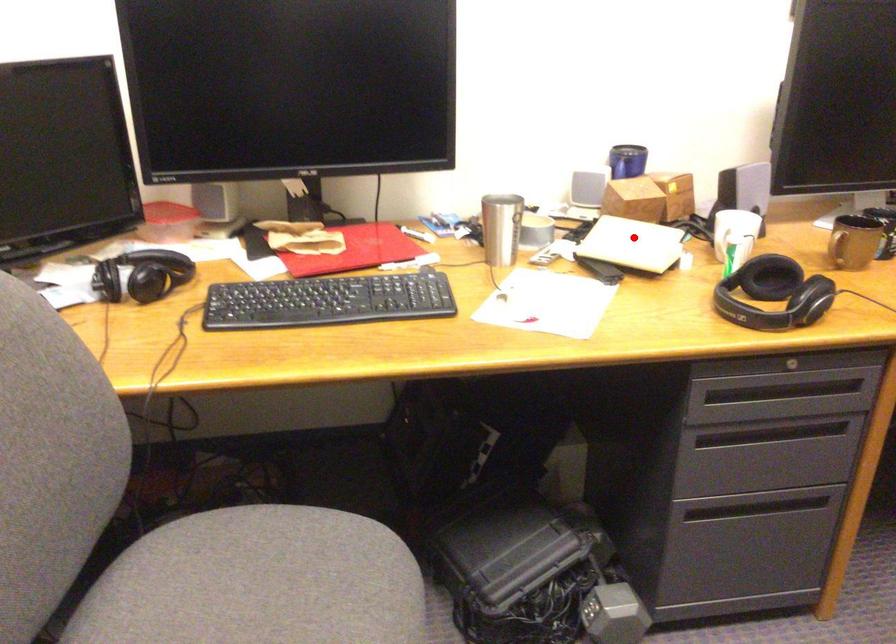
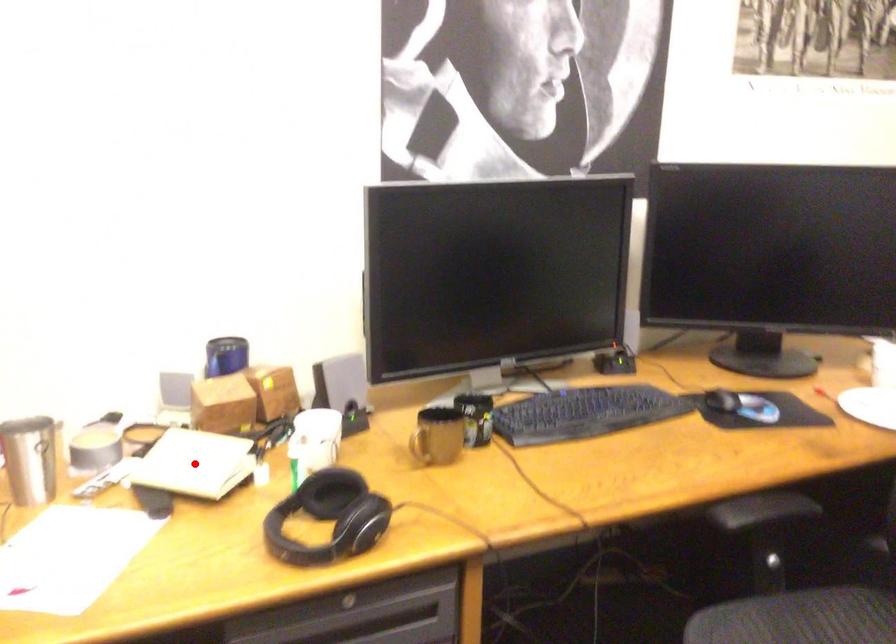
I am providing you with two images of the same scene from different viewpoints. A red point is marked on the first image and another point is marked on the second image. Is the marked point in image1 the same physical position as the marked point in image2?

Yes